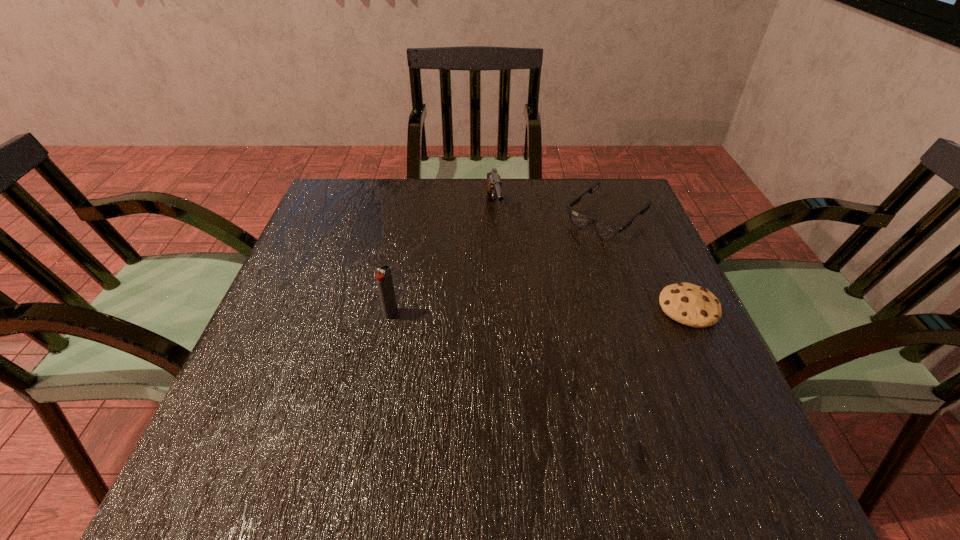
Image resolution: width=960 pixels, height=540 pixels. I want to click on vacant area that lies between the leftmost object and the sunglasses, so click(x=498, y=266).

The width and height of the screenshot is (960, 540). Find the location of `free space between the leftmost object and the sunglasses`. free space between the leftmost object and the sunglasses is located at coordinates (498, 266).

Identify which object is the second closest to the shortest object. Please provide its 2D coordinates. Your answer should be formatted as a tuple, i.e. [(x, y)], where the tuple contains the x and y coordinates of a point satisfying the conditions above.

[(493, 190)]

I want to click on the closest object relative to the third object from right to left, so click(606, 231).

This screenshot has height=540, width=960. Identify the location of free space that satisfies the following two spatial constraints: 1. on the front side of the sunglasses; 2. on the right side of the third object from right to left. (493, 218).

This screenshot has width=960, height=540. What are the coordinates of `free space that satisfies the following two spatial constraints: 1. on the back side of the shortest object; 2. on the right side of the leftmost object` in the screenshot? It's located at (392, 308).